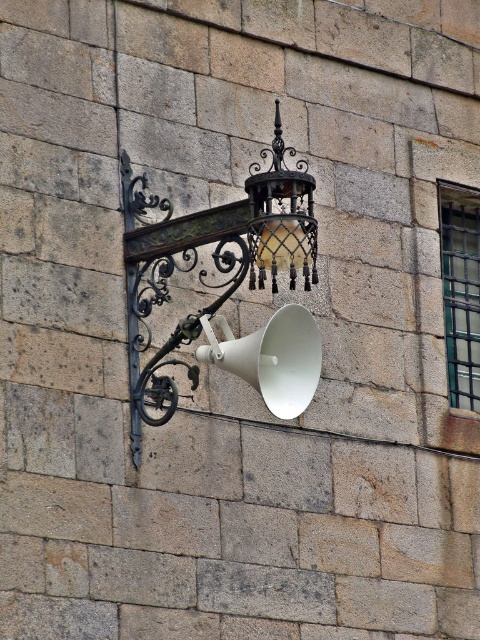
Question: Is matte black lantern at center thinner than matte black lantern at upper center?

Choices:
 (A) yes
 (B) no

Answer: (B)

Question: Which object is positioned farthest from the matte black lantern at upper center?

Choices:
 (A) matte black lantern at center
 (B) white matte megaphone at center

Answer: (B)

Question: Does matte black lantern at center have a smaller size compared to white matte megaphone at center?

Choices:
 (A) no
 (B) yes

Answer: (A)

Question: Based on their relative distances, which object is farther from the matte black lantern at upper center?

Choices:
 (A) matte black lantern at center
 (B) white matte megaphone at center

Answer: (B)

Question: Which point is closer to the camera?

Choices:
 (A) (269, 344)
 (B) (301, 349)
 (C) (262, 209)

Answer: (A)

Question: Does matte black lantern at center have a lesser width compared to matte black lantern at upper center?

Choices:
 (A) no
 (B) yes

Answer: (A)